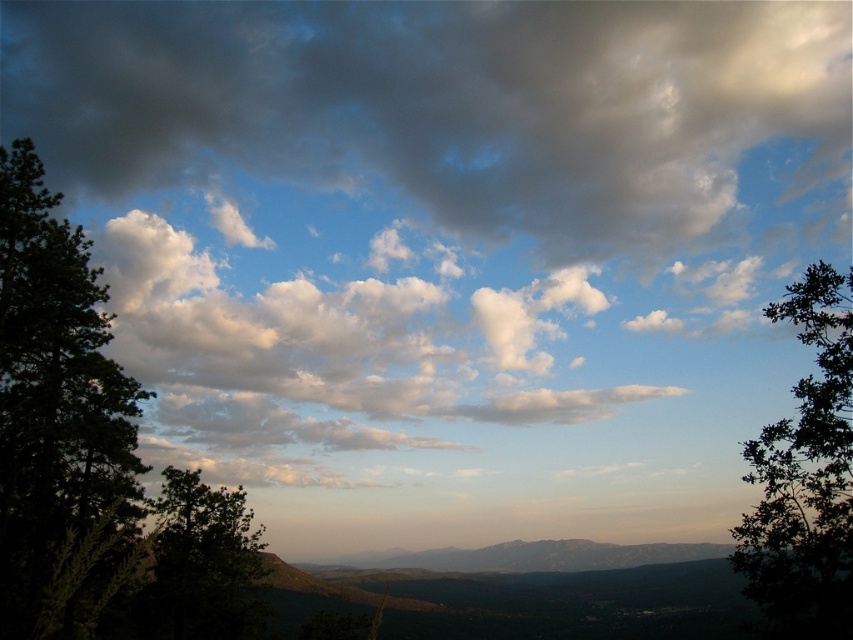
Is cloudy sky at upper center above green leafy tree at right?

Indeed, cloudy sky at upper center is positioned over green leafy tree at right.

Consider the image. Who is higher up, cloudy sky at upper center or green leafy tree at right?

cloudy sky at upper center

Is point (711, 67) positioned before point (813, 467)?

No.

Identify the location of cloudy sky at upper center. (444, 106).

Does cloudy sky at upper center have a smaller size compared to green matte tree at left?

Incorrect, cloudy sky at upper center is not smaller in size than green matte tree at left.

What do you see at coordinates (444, 106) in the screenshot? I see `cloudy sky at upper center` at bounding box center [444, 106].

What do you see at coordinates (444, 106) in the screenshot? This screenshot has width=853, height=640. I see `cloudy sky at upper center` at bounding box center [444, 106].

This screenshot has width=853, height=640. I want to click on cloudy sky at upper center, so click(x=444, y=106).

Is cloudy sky at upper center taller than dark green leafy tree at left?

Yes.

Does cloudy sky at upper center appear under dark green leafy tree at left?

No.

Describe the element at coordinates (444, 106) in the screenshot. I see `cloudy sky at upper center` at that location.

Where is `cloudy sky at upper center`? This screenshot has height=640, width=853. cloudy sky at upper center is located at coordinates (444, 106).